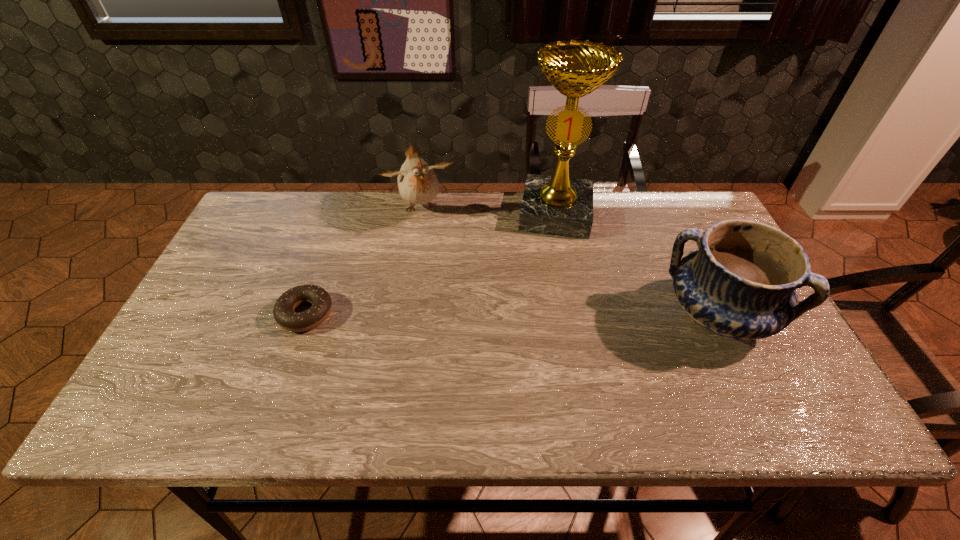
Identify the location of vacant space on the desktop that is between the shortest object and the rightmost object and is positioned on the front-facing side of the award. (545, 315).

Identify the location of vacant space on the desktop that is between the leftmost object and the rightmost object and is positioned at the beak of the bird. This screenshot has width=960, height=540. (456, 314).